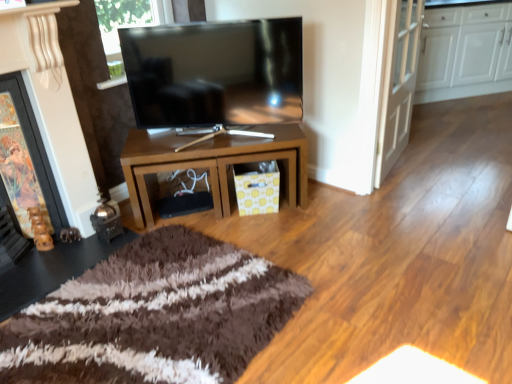
Question: Is matte black tv at center smaller than white glossy cabinets at upper right?

Choices:
 (A) no
 (B) yes

Answer: (B)

Question: Is matte black tv at center to the right of white glossy cabinets at upper right from the viewer's perspective?

Choices:
 (A) no
 (B) yes

Answer: (A)

Question: Is matte black tv at center beside white glossy cabinets at upper right?

Choices:
 (A) no
 (B) yes

Answer: (A)

Question: From a real-world perspective, is matte black tv at center beneath white glossy cabinets at upper right?

Choices:
 (A) yes
 (B) no

Answer: (B)

Question: Would you say matte black tv at center is outside white glossy cabinets at upper right?

Choices:
 (A) no
 (B) yes

Answer: (B)

Question: Does matte black tv at center come in front of white glossy cabinets at upper right?

Choices:
 (A) no
 (B) yes

Answer: (B)

Question: Does matte black tv at center have a lesser height compared to white glossy door at upper right?

Choices:
 (A) no
 (B) yes

Answer: (B)

Question: Can you confirm if matte black tv at center is wider than white glossy door at upper right?

Choices:
 (A) yes
 (B) no

Answer: (A)

Question: Can we say matte black tv at center lies outside white glossy door at upper right?

Choices:
 (A) yes
 (B) no

Answer: (A)

Question: From a real-world perspective, is matte black tv at center beneath white glossy door at upper right?

Choices:
 (A) yes
 (B) no

Answer: (B)

Question: From a real-world perspective, is matte black tv at center over white glossy door at upper right?

Choices:
 (A) yes
 (B) no

Answer: (A)

Question: Is matte black tv at center to the left of white glossy door at upper right from the viewer's perspective?

Choices:
 (A) no
 (B) yes

Answer: (B)

Question: Is wooden fireplace at left looking in the opposite direction of brown glossy table at center?

Choices:
 (A) yes
 (B) no

Answer: (B)